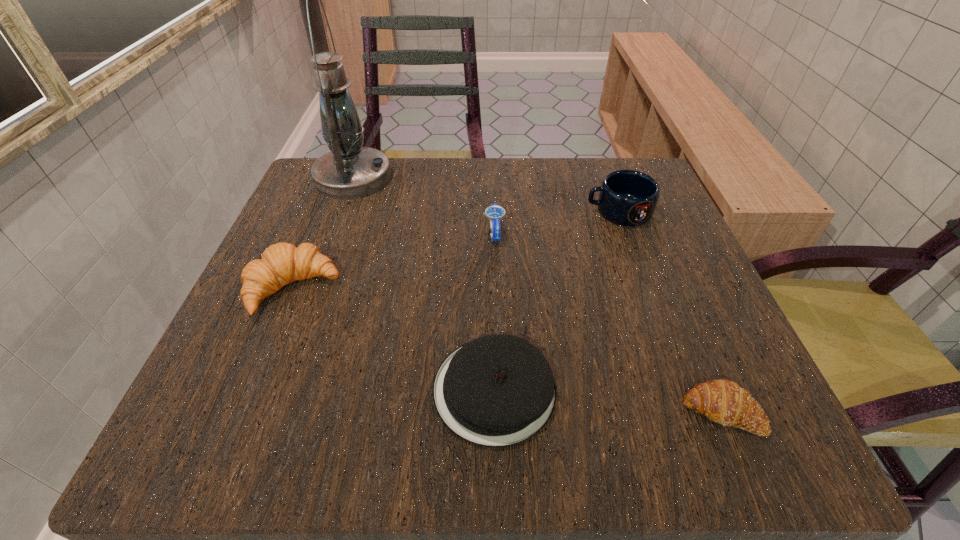
The width and height of the screenshot is (960, 540). Find the location of `free space between the pancake and the watch`. free space between the pancake and the watch is located at coordinates (494, 312).

Where is `unoccupied area between the pancake and the watch`? Image resolution: width=960 pixels, height=540 pixels. unoccupied area between the pancake and the watch is located at coordinates (494, 312).

Identify the location of free spot between the tallest object and the pancake. (423, 284).

Select which object appears as the fourth closest to the mug. Please provide its 2D coordinates. Your answer should be formatted as a tuple, i.e. [(x, y)], where the tuple contains the x and y coordinates of a point satisfying the conditions above.

[(350, 171)]

Select which object appears as the third closest to the tallest object. Please provide its 2D coordinates. Your answer should be formatted as a tuple, i.e. [(x, y)], where the tuple contains the x and y coordinates of a point satisfying the conditions above.

[(495, 391)]